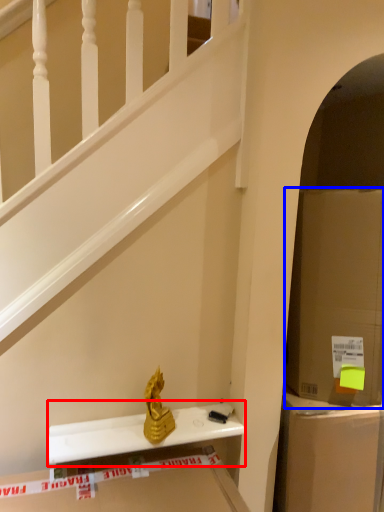
Question: Which of the following is the closest to the observer, window sill (highlighted by a red box) or cardboard box (highlighted by a blue box)?

Choices:
 (A) window sill
 (B) cardboard box

Answer: (A)